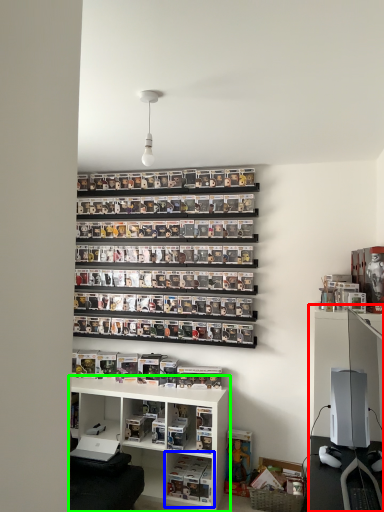
Question: Which object is positioned farthest from entertainment center (highlighted by a red box)? Select from shelf (highlighted by a blue box) and shelf (highlighted by a green box).

Choices:
 (A) shelf
 (B) shelf

Answer: (A)